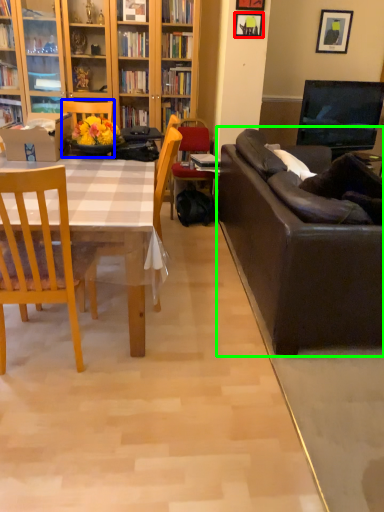
Question: Which object is the farthest from picture frame (highlighted by a red box)? Choose among these: chair (highlighted by a blue box) or studio couch (highlighted by a green box).

Choices:
 (A) chair
 (B) studio couch

Answer: (B)